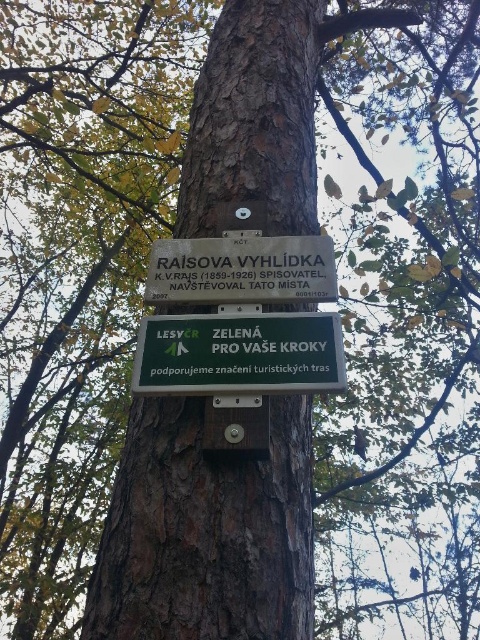
What is the relationship between the widths of the green matte sign at center and the white wooden sign at center?

The green matte sign at center is wider than the white wooden sign at center.

What is the color and material of the object located at point coordinates [239,355]?

The object at point coordinates [239,355] is a green matte sign.

You are a hiker who wants to read both signs on the tree trunk. Since you can only read one sign at a time, which sign should you adjust your position to see first if the green matte sign at center is partially blocking your view of the white wooden sign at center?

You should adjust your position to see the white wooden sign at center first because the green matte sign at center is smaller and might be blocking part of it. By reading the larger white wooden sign first, you can ensure you can see its entire content without obstruction.